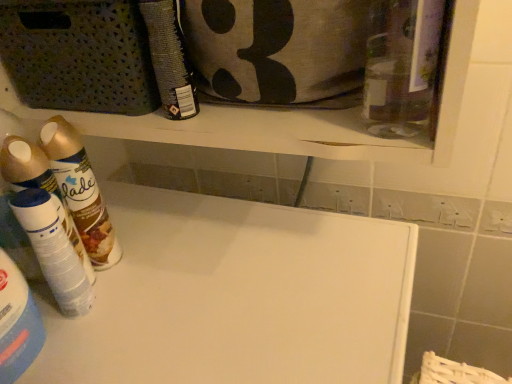
Locate an element on the screen. vacant space behind gold metallic spray can at left, the third cleaning product positioned from the right is located at coordinates click(x=136, y=206).